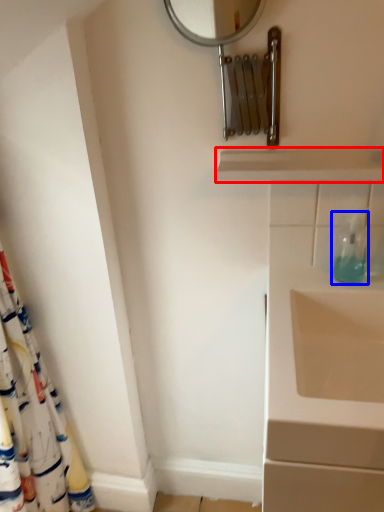
Question: Which object appears farthest to the camera in this image, balustrade (highlighted by a red box) or soap dispenser (highlighted by a blue box)?

Choices:
 (A) balustrade
 (B) soap dispenser

Answer: (B)